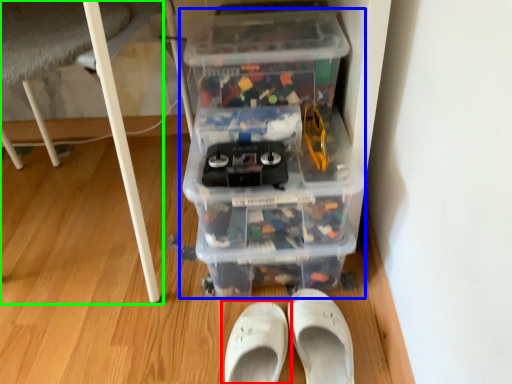
Question: Which object is positioned closest to footwear (highlighted by a red box)? Select from storage box (highlighted by a blue box) and furniture (highlighted by a green box).

Choices:
 (A) storage box
 (B) furniture

Answer: (B)